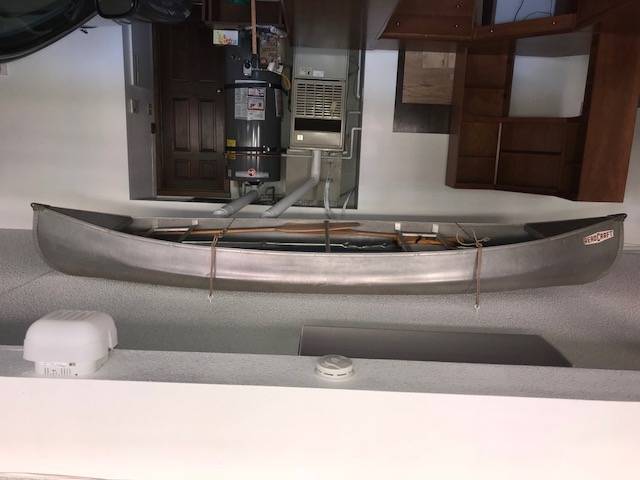
At what (x,y) coordinates should I click in order to perform the action: click on wall. Please return your answer as a coordinate pair (x, y). Looking at the image, I should click on (431, 174).